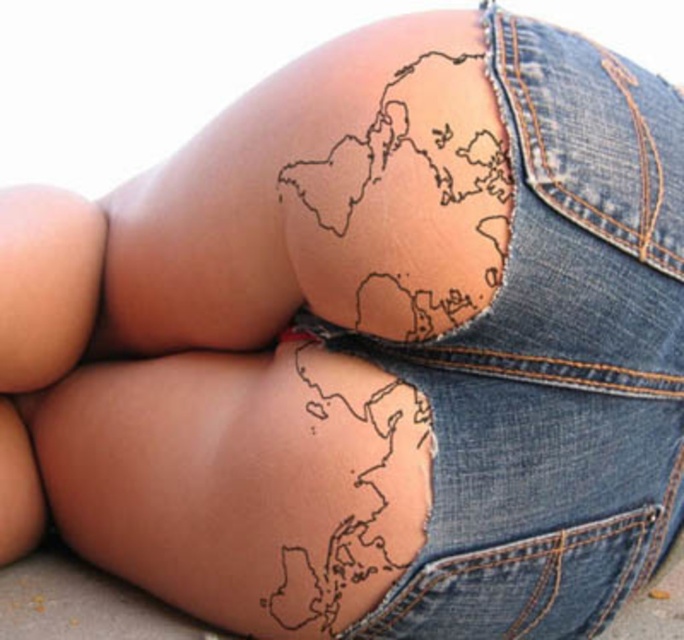
Question: Which point is closer to the camera?

Choices:
 (A) (635, 481)
 (B) (354, 362)

Answer: (B)

Question: Which point appears closest to the camera in this image?

Choices:
 (A) (114, 568)
 (B) (614, 404)

Answer: (B)

Question: Is denim at center thinner than black ink map at lower center?

Choices:
 (A) no
 (B) yes

Answer: (B)

Question: Does denim at center have a smaller size compared to black ink map at lower center?

Choices:
 (A) yes
 (B) no

Answer: (B)

Question: Does denim at center have a greater width compared to black ink map at lower center?

Choices:
 (A) yes
 (B) no

Answer: (B)